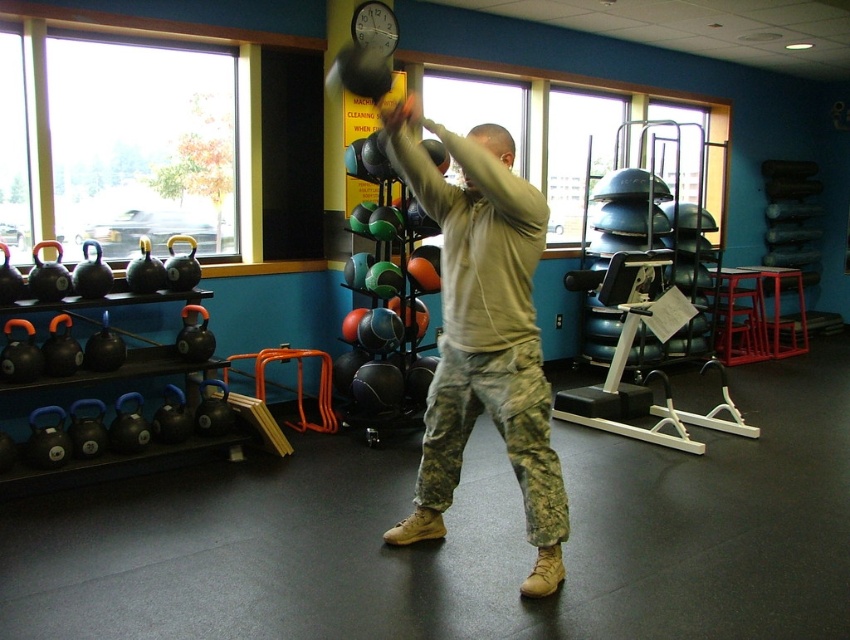
Question: Which point appears farthest from the camera in this image?

Choices:
 (A) (480, 136)
 (B) (536, 241)

Answer: (A)

Question: Can you confirm if camouflage pants at center is positioned above light brown hair at center?

Choices:
 (A) yes
 (B) no

Answer: (B)

Question: Which point is closer to the camera?

Choices:
 (A) (494, 129)
 (B) (527, 189)

Answer: (B)

Question: Which of the following is the farthest from the observer?

Choices:
 (A) light brown hair at center
 (B) camouflage pants at center

Answer: (A)

Question: Can you confirm if camouflage pants at center is positioned above light brown hair at center?

Choices:
 (A) yes
 (B) no

Answer: (B)

Question: Can you confirm if camouflage pants at center is positioned below light brown hair at center?

Choices:
 (A) yes
 (B) no

Answer: (A)